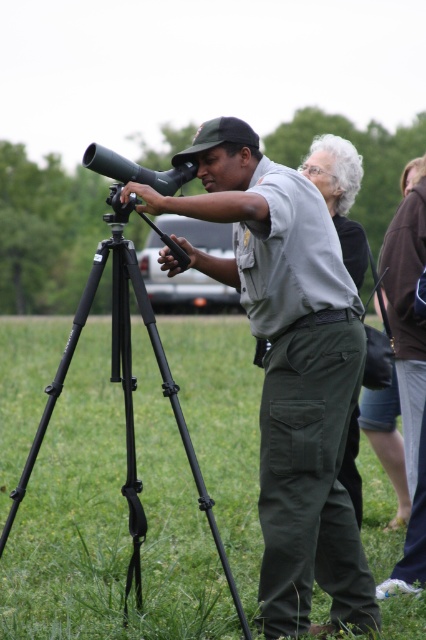
Can you confirm if matte gray uniform at center is shorter than black metal tripod at left?

No, matte gray uniform at center is not shorter than black metal tripod at left.

Between matte gray uniform at center and black metal tripod at left, which one has less height?

Standing shorter between the two is black metal tripod at left.

Is point (255, 163) more distant than point (131, 378)?

No, (255, 163) is in front of (131, 378).

The image size is (426, 640). I want to click on matte gray uniform at center, so click(287, 368).